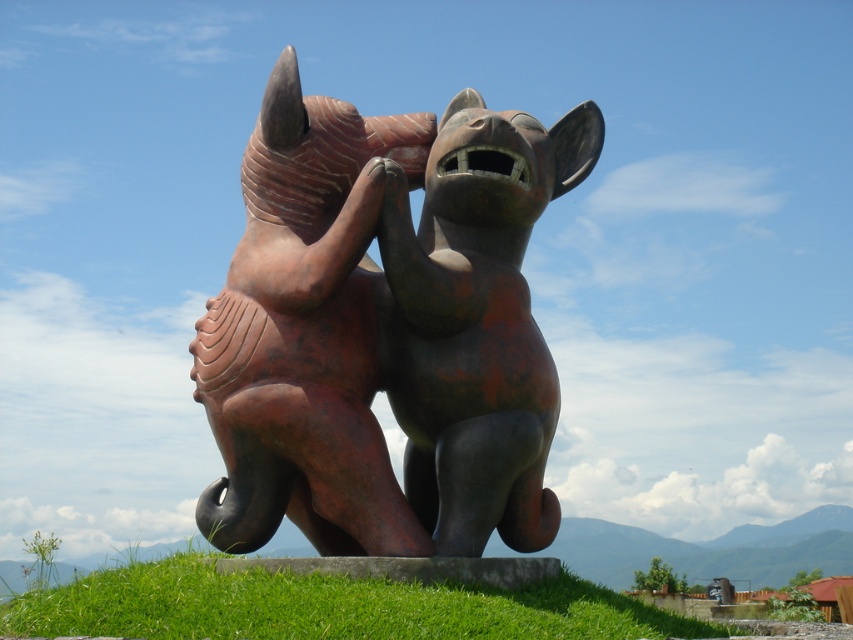
From the picture: Which is above, rusty bronze rhino at center or green grass at center?

rusty bronze rhino at center is above.

Describe the element at coordinates (386, 330) in the screenshot. I see `rusty bronze rhino at center` at that location.

The height and width of the screenshot is (640, 853). Identify the location of rusty bronze rhino at center. (386, 330).